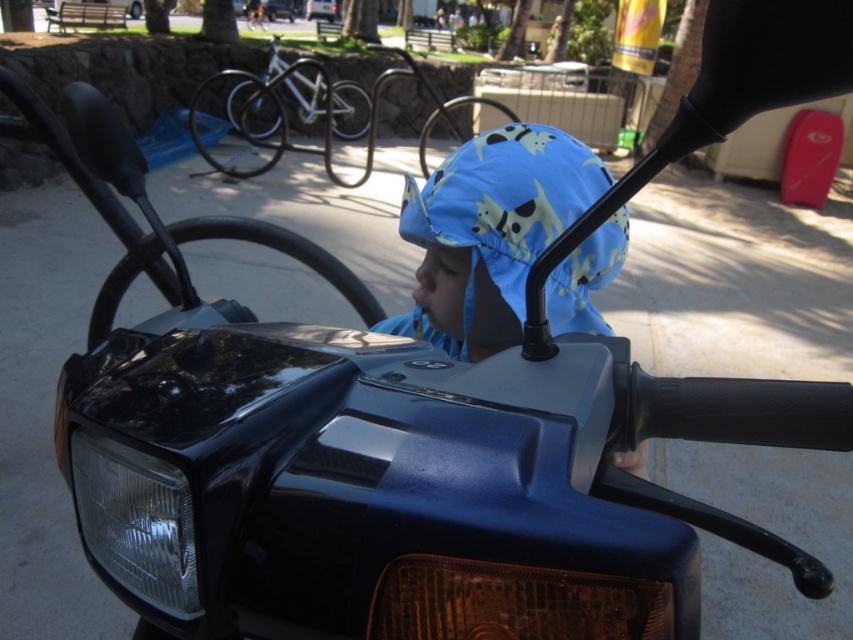
Does blue fabric hat at center have a larger size compared to clear glass headlight at lower left?

Yes.

Identify the location of blue fabric hat at center. The height and width of the screenshot is (640, 853). (489, 232).